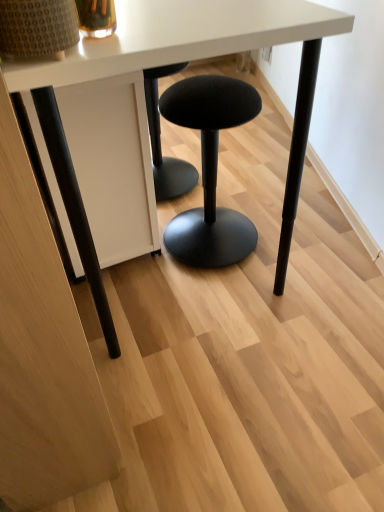
Question: Visually, is black fabric stool at center positioned to the left or to the right of black fabric stool at center?

Choices:
 (A) right
 (B) left

Answer: (A)

Question: Considering the positions of black fabric stool at center and black fabric stool at center in the image, is black fabric stool at center wider or thinner than black fabric stool at center?

Choices:
 (A) thin
 (B) wide

Answer: (B)

Question: Which of these objects is positioned closest to the white matte table at center?

Choices:
 (A) black fabric stool at center
 (B) black fabric stool at center

Answer: (A)

Question: Which object is positioned closest to the white matte table at center?

Choices:
 (A) black fabric stool at center
 (B) black fabric stool at center

Answer: (B)